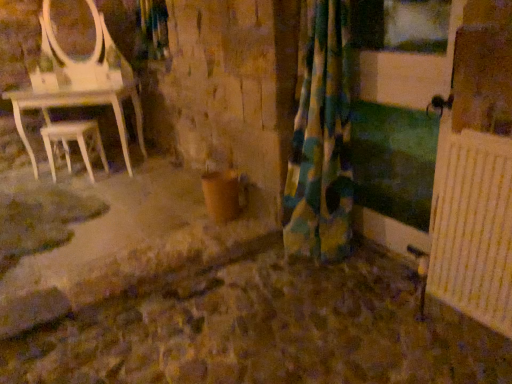
In order to click on fluffy multicolored curtain at center in this screenshot , I will do `click(321, 140)`.

This screenshot has width=512, height=384. Describe the element at coordinates (321, 140) in the screenshot. I see `fluffy multicolored curtain at center` at that location.

Describe the element at coordinates (73, 140) in the screenshot. Image resolution: width=512 pixels, height=384 pixels. I see `white wood stool at left` at that location.

What is the approximate width of white wood stool at left?

It is 11.90 inches.

You are a GUI agent. You are given a task and a screenshot of the screen. Output one action in this format:
    pyautogui.click(x=<x>, y=<y>)
    Task: Click on the white wood stool at left
    
    Given the screenshot: What is the action you would take?
    pyautogui.click(x=73, y=140)

Locate an element on the screen. This screenshot has width=512, height=384. fluffy multicolored curtain at center is located at coordinates (321, 140).

Considering the relative positions of white wood stool at left and fluffy multicolored curtain at center in the image provided, is white wood stool at left to the left or to the right of fluffy multicolored curtain at center?

white wood stool at left is to the left of fluffy multicolored curtain at center.

Between white wood stool at left and fluffy multicolored curtain at center, which one is positioned in front?

fluffy multicolored curtain at center is more forward.

Is point (56, 141) farther from camera compared to point (309, 2)?

Yes, it is behind point (309, 2).

From the image's perspective, is white wood stool at left located above or below fluffy multicolored curtain at center?

white wood stool at left is above fluffy multicolored curtain at center.

From a real-world perspective, is white wood stool at left on fluffy multicolored curtain at center?

No, from a real-world perspective, white wood stool at left is not above fluffy multicolored curtain at center.

Which of these two, white wood stool at left or fluffy multicolored curtain at center, is wider?

fluffy multicolored curtain at center.

Considering the relative sizes of white wood stool at left and fluffy multicolored curtain at center in the image provided, is white wood stool at left taller than fluffy multicolored curtain at center?

No, white wood stool at left is not taller than fluffy multicolored curtain at center.

Considering the sizes of objects white wood stool at left and fluffy multicolored curtain at center in the image provided, who is smaller, white wood stool at left or fluffy multicolored curtain at center?

white wood stool at left.

Is fluffy multicolored curtain at center a part of white wood stool at left?

No, fluffy multicolored curtain at center is located outside of white wood stool at left.

Is white wood stool at left with fluffy multicolored curtain at center?

No, white wood stool at left is not beside fluffy multicolored curtain at center.

Is white wood stool at left facing towards fluffy multicolored curtain at center?

No, white wood stool at left is not oriented towards fluffy multicolored curtain at center.

Locate an element on the screen. curtain below the white wood stool at left (from the image's perspective) is located at coordinates (321, 140).

Between fluffy multicolored curtain at center and white wood stool at left, which one appears on the left side from the viewer's perspective?

Positioned to the left is white wood stool at left.

Is the position of fluffy multicolored curtain at center more distant than that of white wood stool at left?

No, the depth of fluffy multicolored curtain at center is less than that of white wood stool at left.

Does point (297, 149) come farther from viewer compared to point (106, 160)?

No, it is in front of (106, 160).

From the image's perspective, which is above, fluffy multicolored curtain at center or white wood stool at left?

white wood stool at left.

From a real-world perspective, who is located higher, fluffy multicolored curtain at center or white wood stool at left?

From a 3D spatial view, fluffy multicolored curtain at center is above.

Between fluffy multicolored curtain at center and white wood stool at left, which one has larger width?

fluffy multicolored curtain at center is wider.

Is fluffy multicolored curtain at center shorter than white wood stool at left?

Incorrect, the height of fluffy multicolored curtain at center does not fall short of that of white wood stool at left.

Is fluffy multicolored curtain at center bigger than white wood stool at left?

Yes, fluffy multicolored curtain at center is bigger than white wood stool at left.

Is white wood stool at left located within fluffy multicolored curtain at center?

No, fluffy multicolored curtain at center does not contain white wood stool at left.

Is fluffy multicolored curtain at center far from white wood stool at left?

That's right, there is a large distance between fluffy multicolored curtain at center and white wood stool at left.

Is fluffy multicolored curtain at center turned away from white wood stool at left?

No, fluffy multicolored curtain at center is not facing the opposite direction of white wood stool at left.

Find the location of `stool that appears below the fluffy multicolored curtain at center (from a real-world perspective)`. stool that appears below the fluffy multicolored curtain at center (from a real-world perspective) is located at coordinates (73, 140).

This screenshot has width=512, height=384. Find the location of `curtain that appears above the white wood stool at left (from a real-world perspective)`. curtain that appears above the white wood stool at left (from a real-world perspective) is located at coordinates (321, 140).

Where is `curtain that is on the right side of white wood stool at left`? curtain that is on the right side of white wood stool at left is located at coordinates (321, 140).